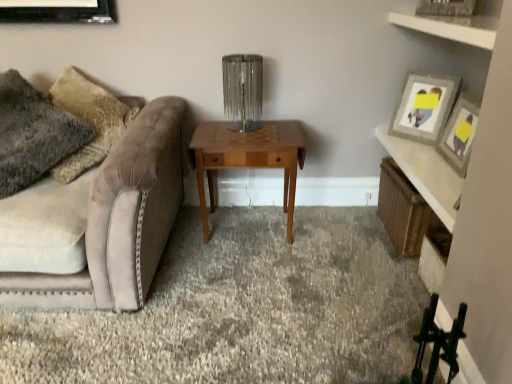
Question: From a real-world perspective, is carpet at center above or below velvet beige couch at left?

Choices:
 (A) above
 (B) below

Answer: (B)

Question: From the image's perspective, relative to velvet beige couch at left, is carpet at center above or below?

Choices:
 (A) above
 (B) below

Answer: (B)

Question: Which of these objects is positioned closest to the wooden table at center?

Choices:
 (A) velvet beige couch at left
 (B) carpet at center
 (C) wooden picture frame at upper right
 (D) clear glass table lamp at center
 (E) white wood shelf at upper right, the second shelf in the bottom-to-top sequence

Answer: (D)

Question: Estimate the real-world distances between objects in this image. Which object is farther from the fuzzy fabric pillow at left?

Choices:
 (A) wooden picture frame at upper right
 (B) wooden table at center
 (C) woven wicker basket at right, the first shelf positioned from the back
 (D) white wood shelf at upper right, acting as the first shelf starting from the front
 (E) velvet beige couch at left

Answer: (A)